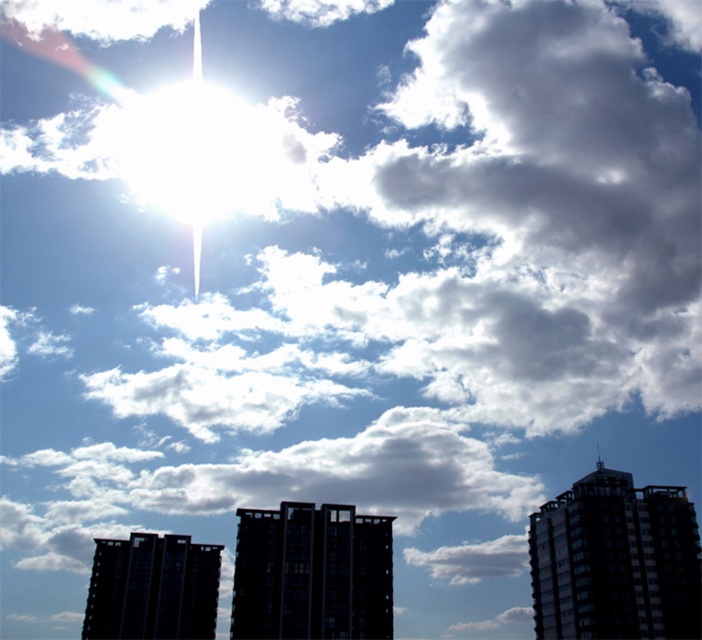
Can you confirm if black glass building at center is bigger than dark glass building at lower left?

No, black glass building at center is not bigger than dark glass building at lower left.

Does point (279, 531) lie in front of point (95, 595)?

Yes, it is.

Measure the distance between point (293, 572) and camera.

Point (293, 572) and camera are 339.25 feet apart.

At what (x,y) coordinates should I click in order to perform the action: click on black glass building at center. Please return your answer as a coordinate pair (x, y). This screenshot has height=640, width=702. Looking at the image, I should click on (311, 573).

Looking at this image, who is positioned more to the left, glassy reflective skyscraper at right or black glass building at center?

black glass building at center is more to the left.

Is glassy reflective skyscraper at right to the right of black glass building at center from the viewer's perspective?

Correct, you'll find glassy reflective skyscraper at right to the right of black glass building at center.

Find the location of `glassy reflective skyscraper at right`. glassy reflective skyscraper at right is located at coordinates (615, 561).

From the picture: Does glassy reflective skyscraper at right come behind dark glass building at lower left?

No, it is in front of dark glass building at lower left.

Between glassy reflective skyscraper at right and dark glass building at lower left, which one has less height?

dark glass building at lower left is shorter.

Is point (694, 595) less distant than point (197, 557)?

Yes, point (694, 595) is closer to viewer.

Locate an element on the screen. The width and height of the screenshot is (702, 640). glassy reflective skyscraper at right is located at coordinates (615, 561).